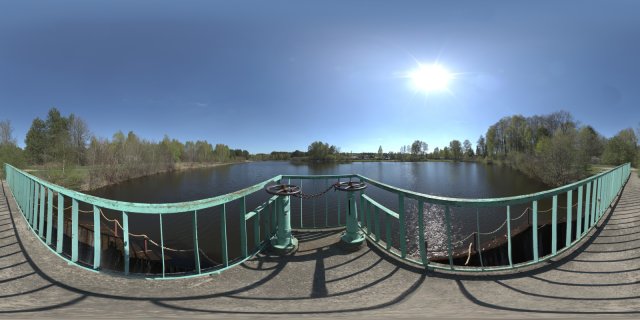
Identify the location of curved railing. This screenshot has height=320, width=640. (109, 202), (504, 199).